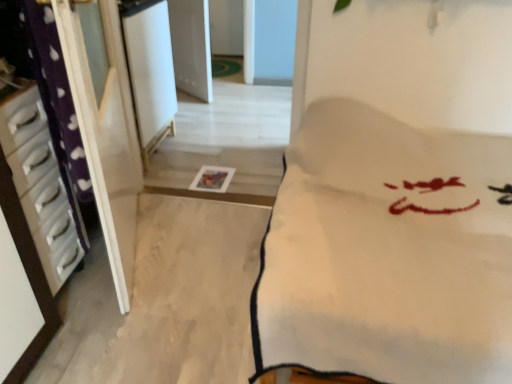
Where is `white soft blanket at center, which appears as the 2th furniture when viewed from the left`? The height and width of the screenshot is (384, 512). white soft blanket at center, which appears as the 2th furniture when viewed from the left is located at coordinates (388, 253).

Where is `white glossy drawer at left, marked as the first furniture in a left-to-right arrangement`? The height and width of the screenshot is (384, 512). white glossy drawer at left, marked as the first furniture in a left-to-right arrangement is located at coordinates click(x=41, y=185).

From the image's perspective, is white glossy drawer at left, marked as the first furniture in a left-to-right arrangement, on white glossy screen door at upper center?

No, from the image's perspective, white glossy drawer at left, marked as the first furniture in a left-to-right arrangement, is not on top of white glossy screen door at upper center.

Is there a large distance between white glossy drawer at left, which ranks as the 2th furniture in right-to-left order, and white glossy screen door at upper center?

white glossy drawer at left, which ranks as the 2th furniture in right-to-left order, is far away from white glossy screen door at upper center.

Is white glossy drawer at left, which ranks as the 2th furniture in right-to-left order, wider than white glossy screen door at upper center?

No, white glossy drawer at left, which ranks as the 2th furniture in right-to-left order, is not wider than white glossy screen door at upper center.

Is white glossy drawer at left, marked as the first furniture in a left-to-right arrangement, oriented away from white glossy screen door at upper center?

No, white glossy screen door at upper center is not at the back of white glossy drawer at left, marked as the first furniture in a left-to-right arrangement.

Based on their sizes in the image, would you say white soft blanket at center, which is the first furniture in right-to-left order, is bigger or smaller than white glossy screen door at upper center?

white soft blanket at center, which is the first furniture in right-to-left order, is bigger than white glossy screen door at upper center.

Considering the relative sizes of white soft blanket at center, which is the first furniture in right-to-left order, and white glossy screen door at upper center in the image provided, is white soft blanket at center, which is the first furniture in right-to-left order, wider than white glossy screen door at upper center?

Yes, white soft blanket at center, which is the first furniture in right-to-left order, is wider than white glossy screen door at upper center.

Does white soft blanket at center, which appears as the 2th furniture when viewed from the left, turn towards white glossy screen door at upper center?

No, white soft blanket at center, which appears as the 2th furniture when viewed from the left, is not turned towards white glossy screen door at upper center.

Is white soft blanket at center, which appears as the 2th furniture when viewed from the left, smaller than white glossy drawer at left, marked as the first furniture in a left-to-right arrangement?

Actually, white soft blanket at center, which appears as the 2th furniture when viewed from the left, might be larger than white glossy drawer at left, marked as the first furniture in a left-to-right arrangement.

Based on the photo, can you confirm if white soft blanket at center, which is the first furniture in right-to-left order, is shorter than white glossy drawer at left, marked as the first furniture in a left-to-right arrangement?

Incorrect, the height of white soft blanket at center, which is the first furniture in right-to-left order, does not fall short of that of white glossy drawer at left, marked as the first furniture in a left-to-right arrangement.

Can you tell me how much white soft blanket at center, which is the first furniture in right-to-left order, and white glossy drawer at left, marked as the first furniture in a left-to-right arrangement, differ in facing direction?

92.2 degrees.

Could you tell me if white soft blanket at center, which is the first furniture in right-to-left order, is facing white glossy drawer at left, marked as the first furniture in a left-to-right arrangement?

No, white soft blanket at center, which is the first furniture in right-to-left order, is not facing towards white glossy drawer at left, marked as the first furniture in a left-to-right arrangement.

Can you confirm if white glossy drawer at left, marked as the first furniture in a left-to-right arrangement, is positioned to the right of white soft blanket at center, which is the first furniture in right-to-left order?

No, white glossy drawer at left, marked as the first furniture in a left-to-right arrangement, is not to the right of white soft blanket at center, which is the first furniture in right-to-left order.

At what (x,y) coordinates should I click in order to perform the action: click on furniture located above the white soft blanket at center, which is the first furniture in right-to-left order (from the image's perspective). Please return your answer as a coordinate pair (x, y). The width and height of the screenshot is (512, 384). Looking at the image, I should click on (41, 185).

From the picture: Considering the relative sizes of white glossy drawer at left, which ranks as the 2th furniture in right-to-left order, and white soft blanket at center, which appears as the 2th furniture when viewed from the left, in the image provided, is white glossy drawer at left, which ranks as the 2th furniture in right-to-left order, thinner than white soft blanket at center, which appears as the 2th furniture when viewed from the left,?

Yes.

Consider the image. Is white glossy drawer at left, which ranks as the 2th furniture in right-to-left order, next to white soft blanket at center, which appears as the 2th furniture when viewed from the left, and touching it?

white glossy drawer at left, which ranks as the 2th furniture in right-to-left order, and white soft blanket at center, which appears as the 2th furniture when viewed from the left, are clearly separated.

There is a white soft blanket at center, which is the first furniture in right-to-left order. Identify the location of screen door above it (from a real-world perspective). (150, 70).

Can you confirm if white glossy screen door at upper center is taller than white soft blanket at center, which is the first furniture in right-to-left order?

No, white glossy screen door at upper center is not taller than white soft blanket at center, which is the first furniture in right-to-left order.

Considering the relative positions of white glossy screen door at upper center and white soft blanket at center, which is the first furniture in right-to-left order, in the image provided, is white glossy screen door at upper center in front of white soft blanket at center, which is the first furniture in right-to-left order,?

No, white glossy screen door at upper center is further to the viewer.

From the picture: Who is taller, white glossy screen door at upper center or white glossy drawer at left, marked as the first furniture in a left-to-right arrangement?

With more height is white glossy screen door at upper center.

Is white glossy screen door at upper center turned away from white glossy drawer at left, marked as the first furniture in a left-to-right arrangement?

white glossy screen door at upper center does not have its back to white glossy drawer at left, marked as the first furniture in a left-to-right arrangement.

From the image's perspective, is white glossy screen door at upper center positioned above or below white glossy drawer at left, which ranks as the 2th furniture in right-to-left order?

white glossy screen door at upper center is situated higher than white glossy drawer at left, which ranks as the 2th furniture in right-to-left order, in the image.

Does white glossy screen door at upper center have a larger size compared to white glossy drawer at left, which ranks as the 2th furniture in right-to-left order?

Yes.

From the image's perspective, count 1st furnitures downward from the white glossy screen door at upper center and point to it. Please provide its 2D coordinates.

[(41, 185)]

Locate an element on the screen. The width and height of the screenshot is (512, 384). screen door behind the white soft blanket at center, which appears as the 2th furniture when viewed from the left is located at coordinates (150, 70).

Considering their positions, is white soft blanket at center, which appears as the 2th furniture when viewed from the left, positioned further to white glossy screen door at upper center than white glossy drawer at left, which ranks as the 2th furniture in right-to-left order?

Among the two, white soft blanket at center, which appears as the 2th furniture when viewed from the left, is located further to white glossy screen door at upper center.

Considering their positions, is white soft blanket at center, which is the first furniture in right-to-left order, positioned further to white glossy drawer at left, which ranks as the 2th furniture in right-to-left order, than white glossy screen door at upper center?

white glossy screen door at upper center.

Looking at the image, which one is located further to white glossy drawer at left, marked as the first furniture in a left-to-right arrangement, white glossy screen door at upper center or white soft blanket at center, which is the first furniture in right-to-left order?

white glossy screen door at upper center is positioned further to the anchor white glossy drawer at left, marked as the first furniture in a left-to-right arrangement.

When comparing their distances from white soft blanket at center, which appears as the 2th furniture when viewed from the left, does white glossy drawer at left, marked as the first furniture in a left-to-right arrangement, or white glossy screen door at upper center seem closer?

white glossy drawer at left, marked as the first furniture in a left-to-right arrangement, lies closer to white soft blanket at center, which appears as the 2th furniture when viewed from the left, than the other object.

Which object lies further to the anchor point white glossy screen door at upper center, white glossy drawer at left, which ranks as the 2th furniture in right-to-left order, or white soft blanket at center, which appears as the 2th furniture when viewed from the left?

Among the two, white soft blanket at center, which appears as the 2th furniture when viewed from the left, is located further to white glossy screen door at upper center.

From the image, which object appears to be nearer to white soft blanket at center, which is the first furniture in right-to-left order, white glossy screen door at upper center or white glossy drawer at left, which ranks as the 2th furniture in right-to-left order?

Based on the image, white glossy drawer at left, which ranks as the 2th furniture in right-to-left order, appears to be nearer to white soft blanket at center, which is the first furniture in right-to-left order.

Locate an element on the screen. The width and height of the screenshot is (512, 384). screen door between white glossy drawer at left, which ranks as the 2th furniture in right-to-left order, and white soft blanket at center, which is the first furniture in right-to-left order, from left to right is located at coordinates tap(150, 70).